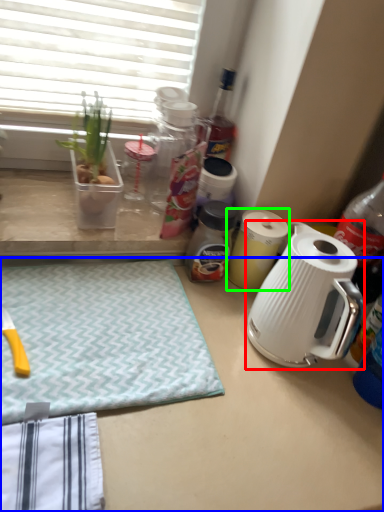
Question: Estimate the real-world distances between objects in this image. Which object is farther from kettle (highlighted by a red box), desk (highlighted by a blue box) or kitchen appliance (highlighted by a green box)?

Choices:
 (A) desk
 (B) kitchen appliance

Answer: (A)